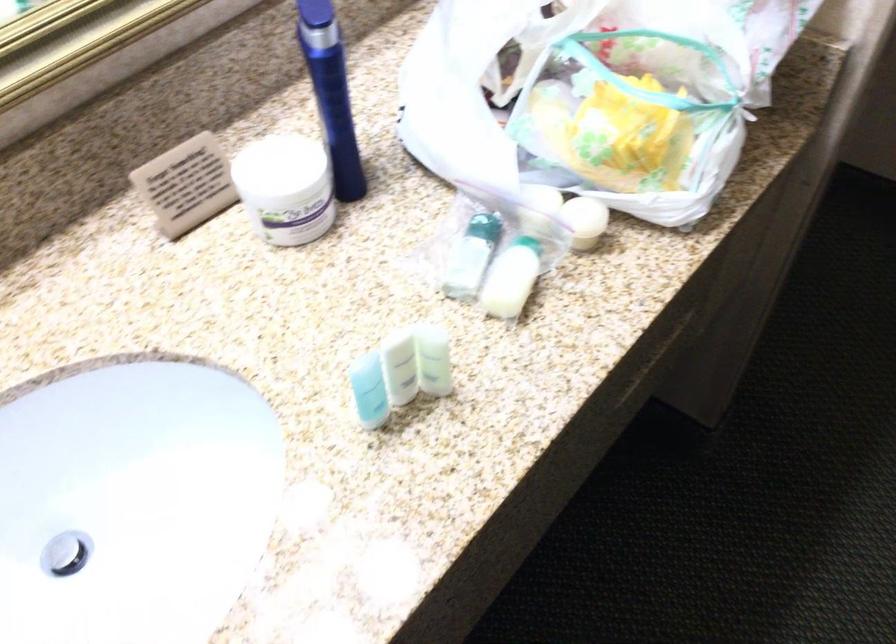
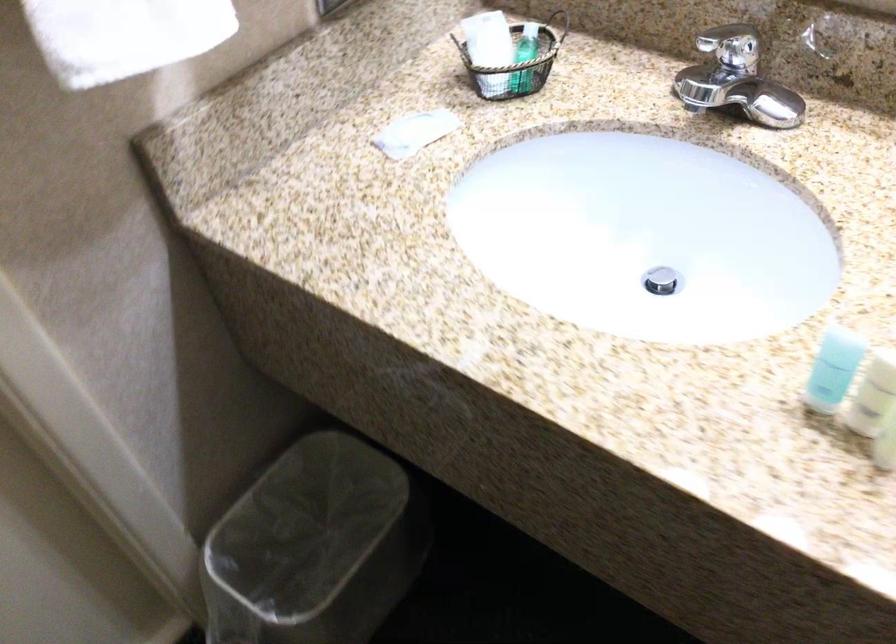
Find the pixel in the second image that matches the point at 395,375 in the first image.

(873, 395)